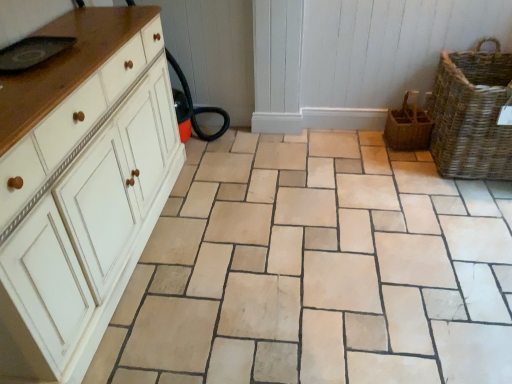
The width and height of the screenshot is (512, 384). What are the coordinates of `free space in front of woven brown basket at right, the second basket viewed from the right` in the screenshot? It's located at 405,163.